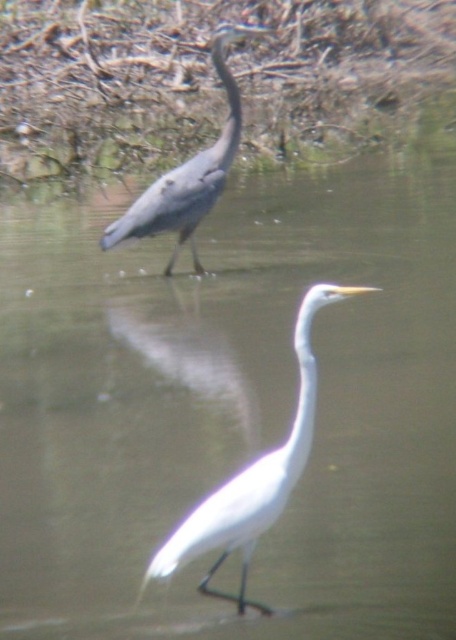
You are a birdwatcher observing the scene. You see the white smooth bird at center and the gray matte heron at upper left. Which heron is located to the right of the other?

The white smooth bird at center is positioned on the right side of gray matte heron at upper left.

You are a birdwatcher trying to locate the white smooth bird at center in the image. What are the coordinates where you should focus your binoculars?

The coordinates to focus your binoculars on the white smooth bird at center are at point (253, 477).

You are a wildlife photographer aiming to capture both the white smooth bird at center and the gray matte heron at upper left in a single frame. Based on their sizes, which bird would appear smaller in your photo?

The white smooth bird at center would appear smaller in your photo because it has a lesser width compared to the gray matte heron at upper left.